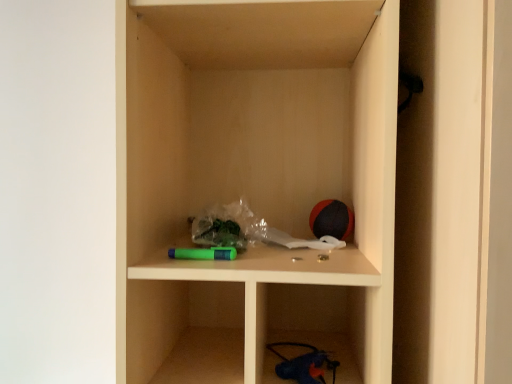
Question: From a real-world perspective, relative to rubberized red and black ball at upper right, is matte plastic cabinet at center vertically above or below?

Choices:
 (A) below
 (B) above

Answer: (B)

Question: In the image, is matte plastic cabinet at center positioned in front of or behind rubberized red and black ball at upper right?

Choices:
 (A) behind
 (B) front

Answer: (B)

Question: Considering the positions of matte plastic cabinet at center and rubberized red and black ball at upper right in the image, is matte plastic cabinet at center wider or thinner than rubberized red and black ball at upper right?

Choices:
 (A) wide
 (B) thin

Answer: (A)

Question: Is rubberized red and black ball at upper right spatially inside matte plastic cabinet at center, or outside of it?

Choices:
 (A) outside
 (B) inside

Answer: (B)

Question: Is rubberized red and black ball at upper right in front of or behind matte plastic cabinet at center in the image?

Choices:
 (A) front
 (B) behind

Answer: (B)

Question: From the image's perspective, is rubberized red and black ball at upper right above or below matte plastic cabinet at center?

Choices:
 (A) above
 (B) below

Answer: (B)

Question: From their relative heights in the image, would you say rubberized red and black ball at upper right is taller or shorter than matte plastic cabinet at center?

Choices:
 (A) short
 (B) tall

Answer: (A)